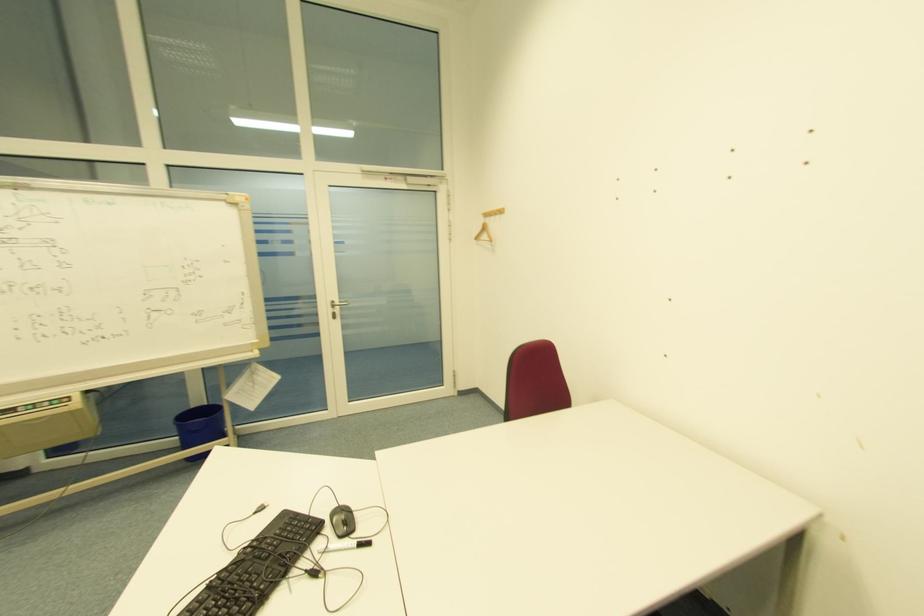
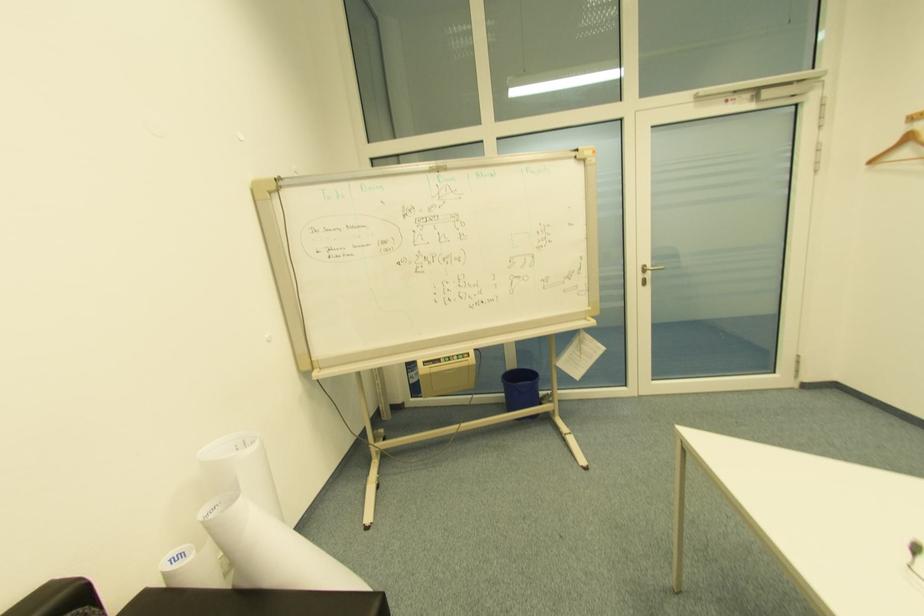
Question: The images are taken continuously from a first-person perspective. In which direction are you moving?

Choices:
 (A) Left
 (B) Right
 (C) Forward
 (D) Backward

Answer: (A)